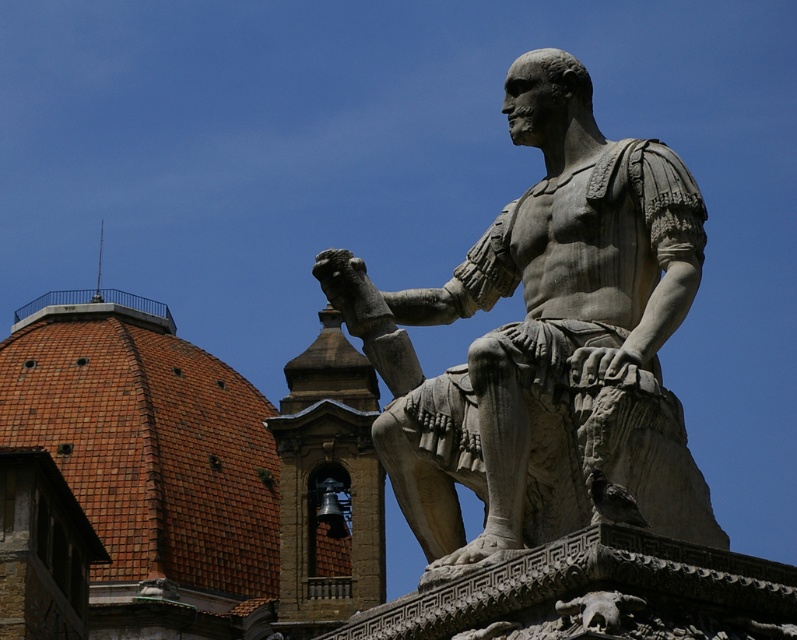
Question: Which point is closer to the camera?

Choices:
 (A) gray stone statue at center
 (B) bronze bell at center

Answer: (A)

Question: Observing the image, what is the correct spatial positioning of gray stone statue at center in reference to bronze bell at center?

Choices:
 (A) right
 (B) left

Answer: (A)

Question: Among these objects, which one is farthest from the camera?

Choices:
 (A) bronze bell at center
 (B) gray stone statue at center

Answer: (A)

Question: Among these objects, which one is nearest to the camera?

Choices:
 (A) gray stone statue at center
 (B) bronze bell at center

Answer: (A)

Question: Is gray stone statue at center bigger than bronze bell at center?

Choices:
 (A) no
 (B) yes

Answer: (A)

Question: Is gray stone statue at center positioned in front of bronze bell at center?

Choices:
 (A) yes
 (B) no

Answer: (A)